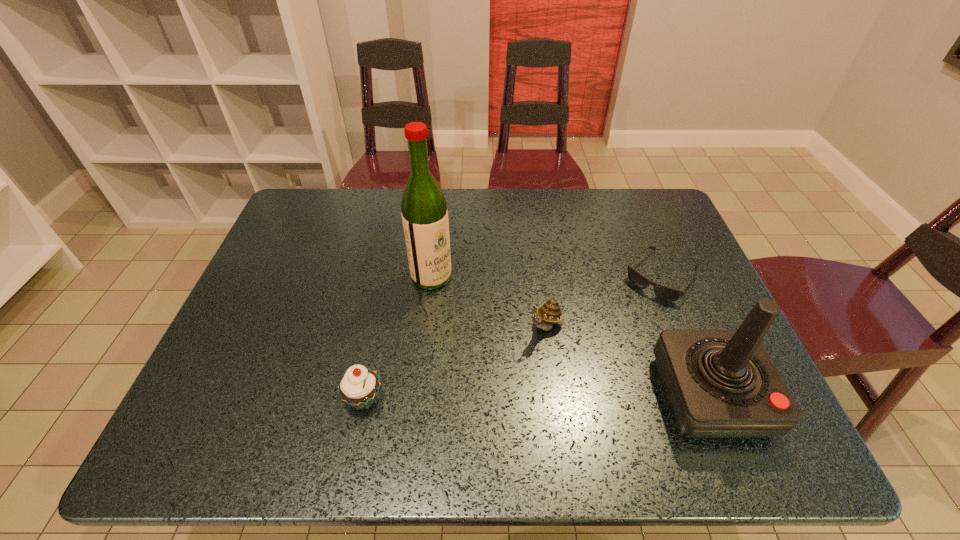
You are a GUI agent. You are given a task and a screenshot of the screen. Output one action in this format:
    pyautogui.click(x=<x>, y=<y>)
    Task: Click on the sunglasses that is at the right edge
    Image resolution: width=960 pixels, height=540 pixels.
    Given the screenshot: What is the action you would take?
    pyautogui.click(x=663, y=292)

Locate an element on the screen. This screenshot has height=540, width=960. object located in the near right corner section of the desktop is located at coordinates (719, 383).

Locate an element on the screen. vacant region at the far edge is located at coordinates (361, 189).

In the image, there is a desktop. At what (x,y) coordinates should I click in order to perform the action: click on vacant space at the near edge. Please return your answer as a coordinate pair (x, y). Looking at the image, I should click on (478, 387).

Where is `free space at the left edge`? This screenshot has height=540, width=960. free space at the left edge is located at coordinates (251, 299).

Locate an element on the screen. The image size is (960, 540). vacant area at the right edge is located at coordinates [x=676, y=275].

Identify the location of vacant space at the far left corner. The width and height of the screenshot is (960, 540). (329, 226).

Identify the location of free space at the near left corner. This screenshot has height=540, width=960. (226, 375).

Identify the location of free spot at the far right corner of the desktop. (642, 234).

Find the location of a particular element. blank region between the snail and the tallest object is located at coordinates (489, 302).